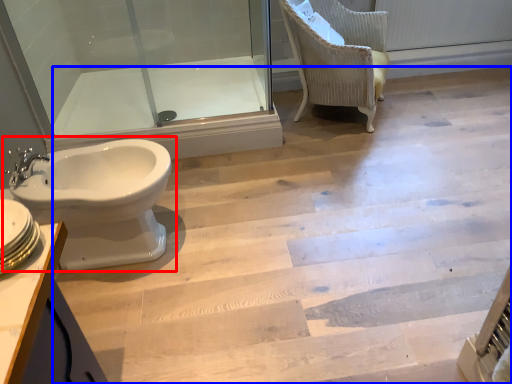
Question: Which object is further to the camera taking this photo, toilet (highlighted by a red box) or stairwell (highlighted by a blue box)?

Choices:
 (A) toilet
 (B) stairwell

Answer: (A)